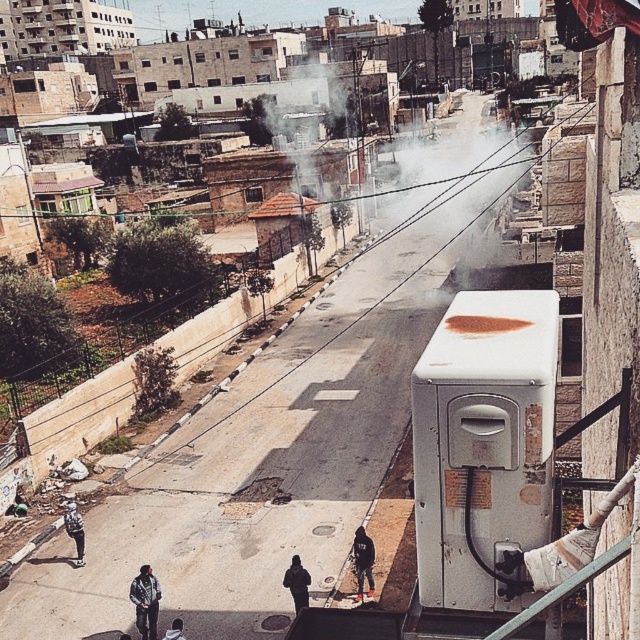
Based on the photo, which of these two, dark gray jacket at lower left or dark blue jeans at lower left, stands taller?

dark gray jacket at lower left is taller.

Who is more distant from viewer, (141,596) or (81,547)?

Positioned behind is point (81,547).

Does point (156, 596) come farther from viewer compared to point (72, 502)?

That is False.

The image size is (640, 640). Find the location of `dark gray jacket at lower left`. dark gray jacket at lower left is located at coordinates (145, 602).

Which is in front, point (147, 630) or point (173, 624)?

Point (173, 624) is in front.

Between dark gray jacket at lower left and dark gray hoodie at lower center, which one is positioned lower?

Positioned lower is dark gray jacket at lower left.

Who is more distant from viewer, (138, 618) or (170, 637)?

Point (138, 618)

Locate an element on the screen. dark gray jacket at lower left is located at coordinates (145, 602).

Does dark gray jacket at lower left have a smaller size compared to dark gray jacket at center?

No, dark gray jacket at lower left is not smaller than dark gray jacket at center.

Is dark gray jacket at lower left above dark gray jacket at center?

Incorrect, dark gray jacket at lower left is not positioned above dark gray jacket at center.

Which is behind, point (148, 589) or point (296, 605)?

Point (296, 605)

Image resolution: width=640 pixels, height=640 pixels. Find the location of `dark gray jacket at lower left`. dark gray jacket at lower left is located at coordinates (145, 602).